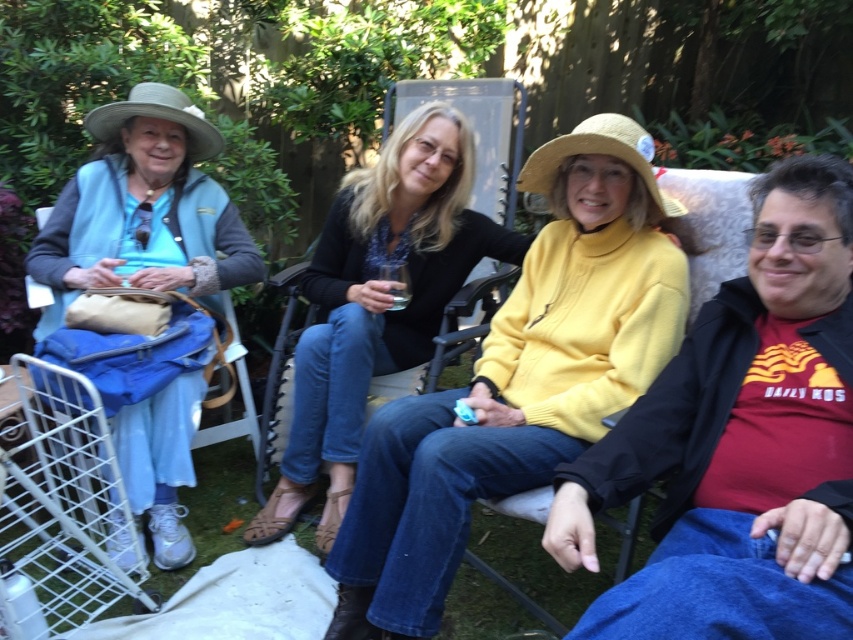
Who is taller, matte black sweater at center or light blue denim pants at left?

matte black sweater at center

Can you confirm if matte black sweater at center is bigger than light blue denim pants at left?

Indeed, matte black sweater at center has a larger size compared to light blue denim pants at left.

The width and height of the screenshot is (853, 640). Describe the element at coordinates (376, 301) in the screenshot. I see `matte black sweater at center` at that location.

Where is `matte black sweater at center`? The height and width of the screenshot is (640, 853). matte black sweater at center is located at coordinates (376, 301).

Looking at this image, can you confirm if yellow turtleneck sweater at center is thinner than matte black sweater at center?

Yes.

Can you confirm if yellow turtleneck sweater at center is wider than matte black sweater at center?

No, yellow turtleneck sweater at center is not wider than matte black sweater at center.

At what (x,y) coordinates should I click in order to perform the action: click on yellow turtleneck sweater at center. Please return your answer as a coordinate pair (x, y). The image size is (853, 640). Looking at the image, I should click on [x=740, y=442].

Does matte black sweater at center lie behind white wire shopping cart at lower left?

Yes, it is.

Between matte black sweater at center and white wire shopping cart at lower left, which one is positioned higher?

matte black sweater at center is higher up.

Is point (305, 490) positioned behind point (15, 515)?

Yes, point (305, 490) is behind point (15, 515).

Locate an element on the screen. The height and width of the screenshot is (640, 853). matte black sweater at center is located at coordinates (376, 301).